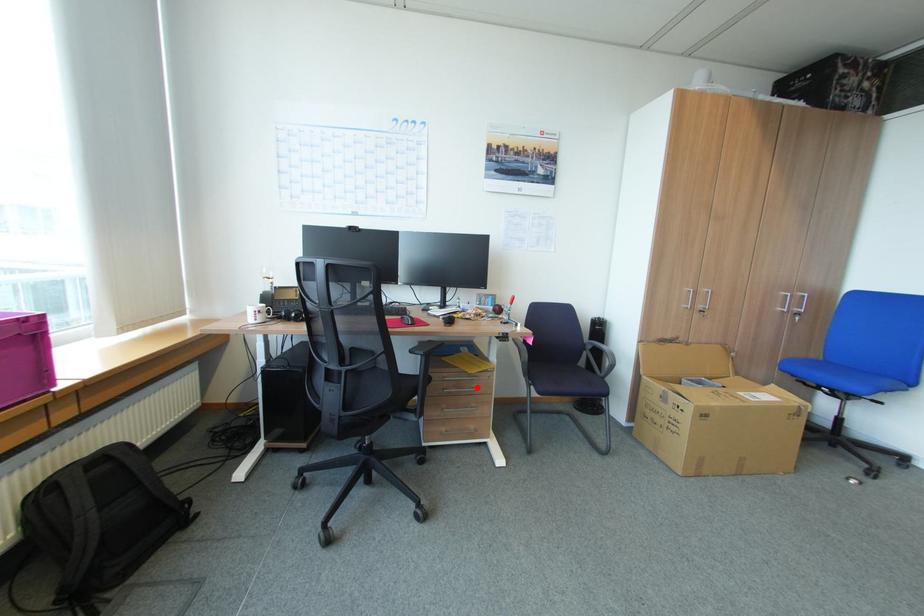
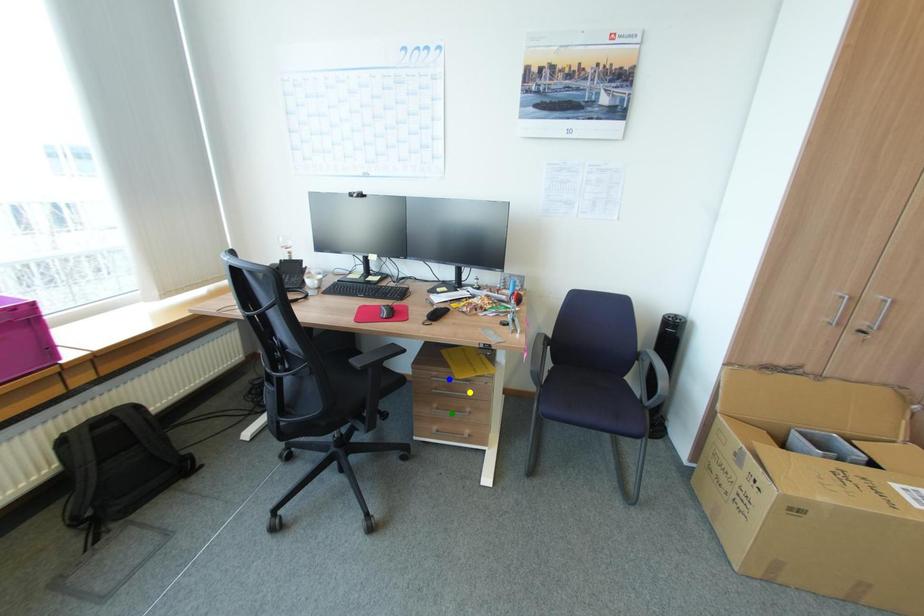
Question: I am providing you with two images of the same scene from different viewpoints. A red point is marked on the first image. You are given multiple points on the second image. Which point in image 2 represents the same 3d spot as the red point in image 1?

Choices:
 (A) green point
 (B) blue point
 (C) yellow point

Answer: (C)